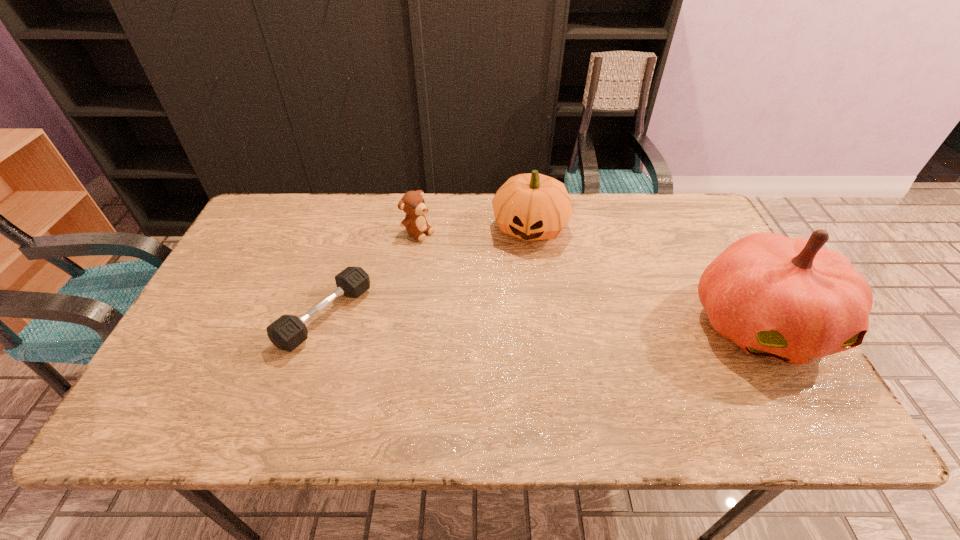
Locate an element on the screen. The width and height of the screenshot is (960, 540). free space located 0.130m on the side of the second tallest object with the carved face is located at coordinates (518, 283).

Where is `vacant space located 0.240m on the side of the second tallest object with the carved face`? The height and width of the screenshot is (540, 960). vacant space located 0.240m on the side of the second tallest object with the carved face is located at coordinates (512, 313).

Identify the location of blank area located 0.370m on the face of the second object from left to right. (529, 296).

Identify the location of vacant space located on the face of the second object from left to right. (539, 301).

Locate an element on the screen. The height and width of the screenshot is (540, 960). free region located on the face of the second object from left to right is located at coordinates (457, 254).

I want to click on gourd positioned at the far edge, so click(532, 206).

Where is `teddy bear located at the far edge`? Image resolution: width=960 pixels, height=540 pixels. teddy bear located at the far edge is located at coordinates (412, 203).

Find the location of a particular element. The height and width of the screenshot is (540, 960). object positioned at the near edge is located at coordinates (791, 299).

Where is `object situated at the right edge`? This screenshot has height=540, width=960. object situated at the right edge is located at coordinates (791, 299).

Identify the location of object that is positioned at the near right corner. This screenshot has width=960, height=540. (791, 299).